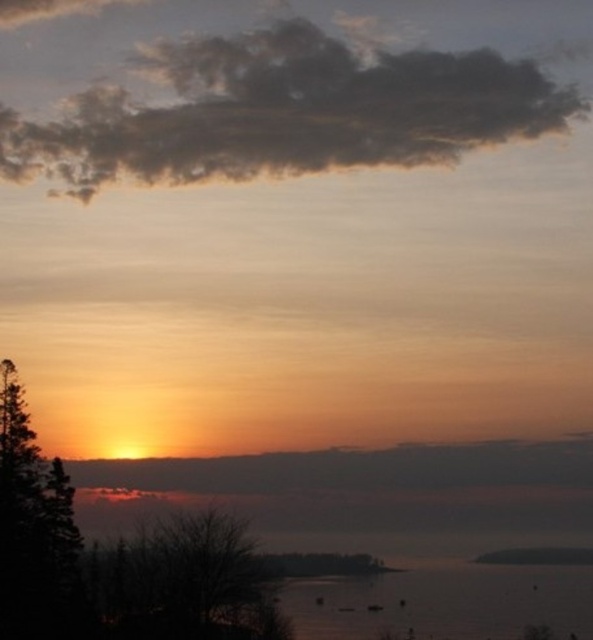
You are an artist trying to paint the sunset scene. You need to decide which object should be placed lower in your painting. Based on the scene, which one should you place lower between the silvery reflective water at lower center and the dark green leafy tree at left?

The silvery reflective water at lower center should be placed lower in the painting because it is not as tall as the dark green leafy tree at left.